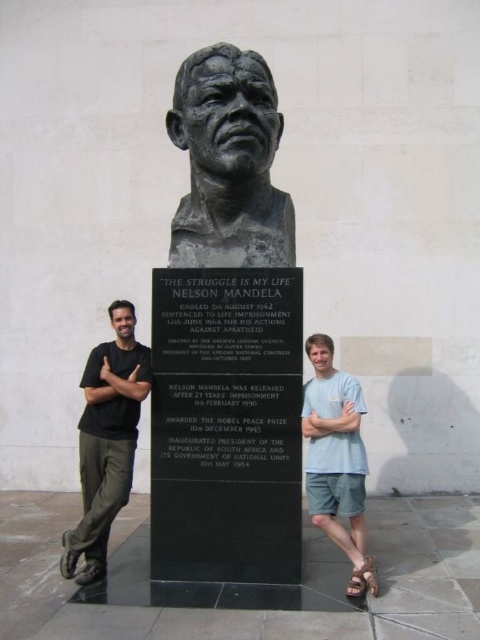
Question: Which point appears farthest from the camera in this image?

Choices:
 (A) (266, 180)
 (B) (346, 497)
 (C) (95, 502)

Answer: (A)

Question: Considering the relative positions of bronze sculpture at center and light blue t-shirt at right in the image provided, where is bronze sculpture at center located with respect to light blue t-shirt at right?

Choices:
 (A) above
 (B) below

Answer: (A)

Question: Does bronze sculpture at center appear on the left side of light blue t-shirt at right?

Choices:
 (A) yes
 (B) no

Answer: (A)

Question: Based on their relative distances, which object is nearer to the bronze sculpture at center?

Choices:
 (A) black cotton shirt at left
 (B) light blue t-shirt at right

Answer: (A)

Question: Does bronze sculpture at center appear on the right side of light blue t-shirt at right?

Choices:
 (A) no
 (B) yes

Answer: (A)

Question: Which of the following is the closest to the observer?

Choices:
 (A) black cotton shirt at left
 (B) light blue t-shirt at right
 (C) bronze sculpture at center

Answer: (B)